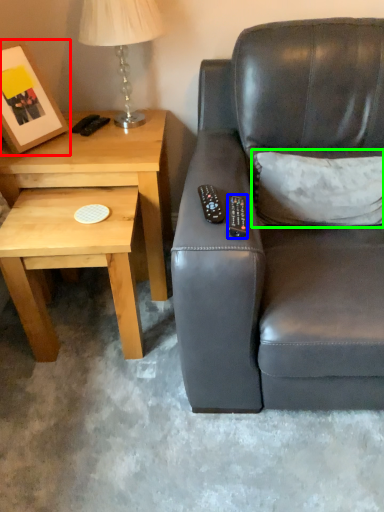
Question: Considering the real-world distances, which object is closest to picture frame (highlighted by a red box)? remote (highlighted by a blue box) or throw pillow (highlighted by a green box).

Choices:
 (A) remote
 (B) throw pillow

Answer: (A)